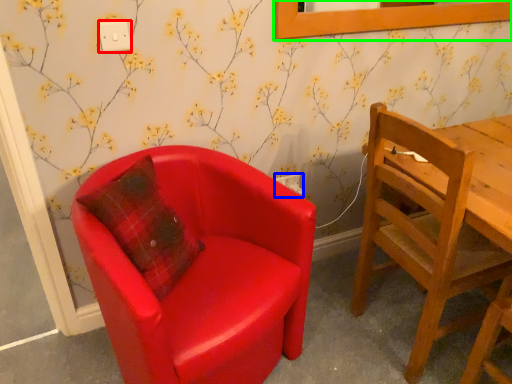
Question: Based on their relative distances, which object is nearer to power outlet (highlighted by a red box)? Choose from power outlet (highlighted by a blue box) and picture frame (highlighted by a green box).

Choices:
 (A) power outlet
 (B) picture frame

Answer: (A)